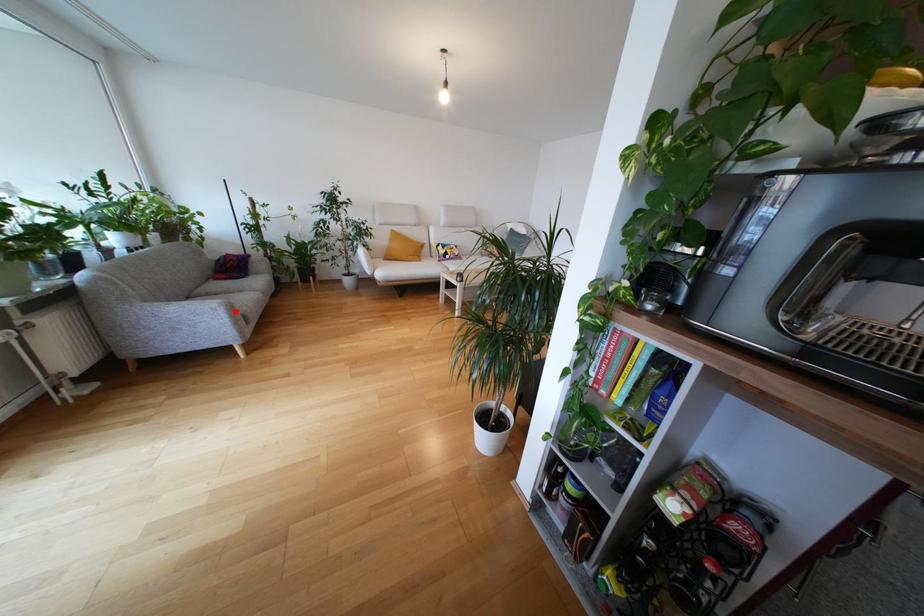
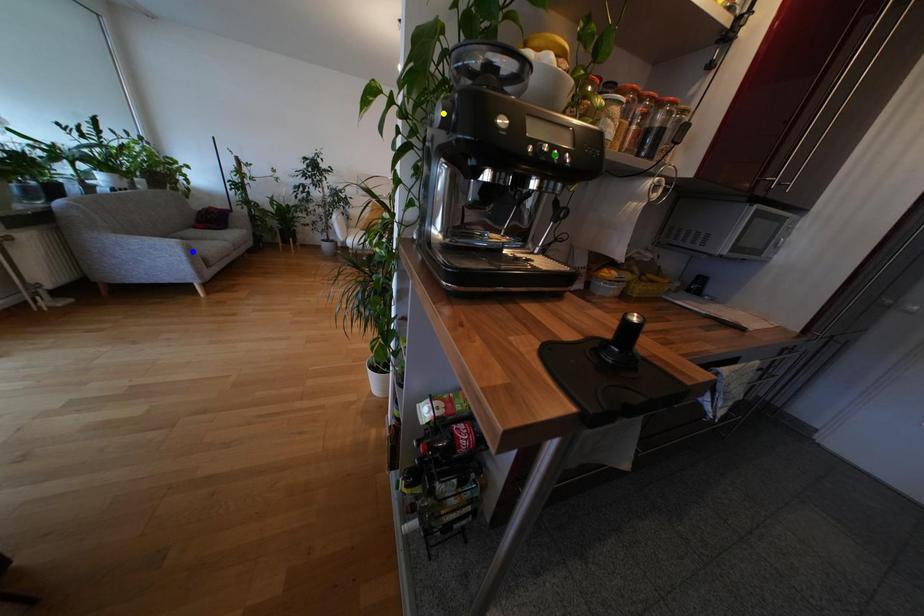
Question: I am providing you with two images of the same scene from different viewpoints. A red point is marked on the first image. You are given multiple points on the second image. Which point in image 2 represents the same 3d spot as the red point in image 1?

Choices:
 (A) yellow point
 (B) green point
 (C) blue point

Answer: (C)